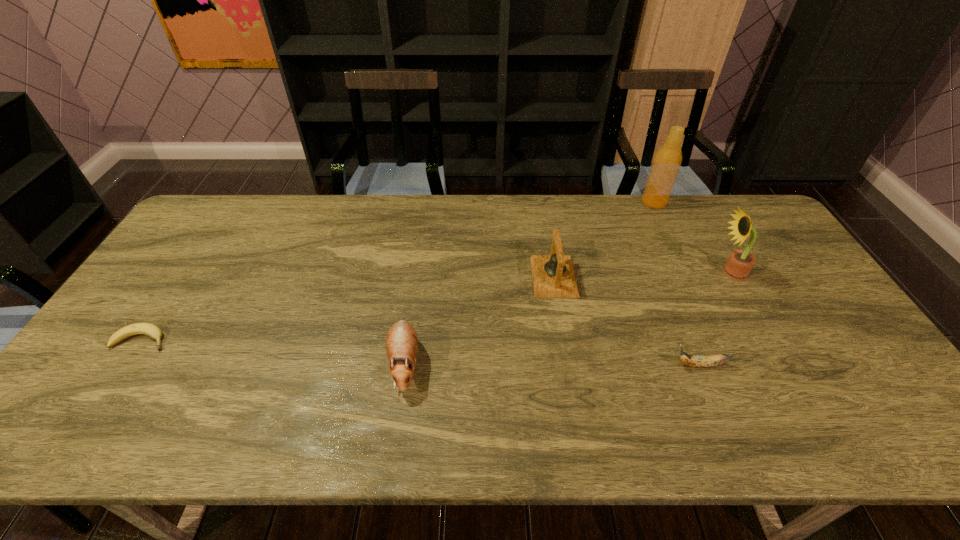
Find the location of a particular element. free space between the hamster and the tallest object is located at coordinates (529, 282).

I want to click on vacant region between the tallest object and the hamster, so click(x=529, y=282).

Locate an element on the screen. This screenshot has height=540, width=960. empty location between the farthest object and the shortest object is located at coordinates (397, 271).

Where is `empty space that is in between the bell and the beer bottle`? Image resolution: width=960 pixels, height=540 pixels. empty space that is in between the bell and the beer bottle is located at coordinates (604, 239).

Identify the location of empty space between the fifth shortest object and the second object from left to right. (567, 318).

Locate an element on the screen. The image size is (960, 540). vacant area between the beer bottle and the fifth object from right to left is located at coordinates (529, 282).

Locate an element on the screen. This screenshot has width=960, height=540. vacant region between the shorter banana and the farthest object is located at coordinates (397, 271).

You are a GUI agent. You are given a task and a screenshot of the screen. Output one action in this format:
    pyautogui.click(x=<x>, y=<y>)
    Task: Click on the unoccupied area between the bell and the fifth tallest object
    Image resolution: width=960 pixels, height=540 pixels.
    Given the screenshot: What is the action you would take?
    pyautogui.click(x=627, y=321)

I want to click on object that stands as the fourth closest to the fourth object from right to left, so click(x=739, y=264).

Identify the location of the closest object to the fourth object from right to left. This screenshot has width=960, height=540. (698, 361).